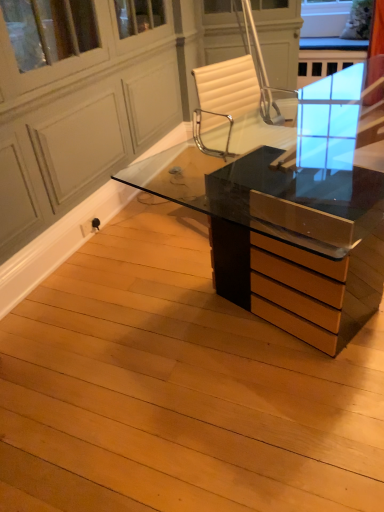
The image size is (384, 512). What do you see at coordinates (78, 102) in the screenshot? I see `transparent glass screen door at upper center` at bounding box center [78, 102].

What are the coordinates of `transparent glass screen door at upper center` in the screenshot? It's located at (78, 102).

Identify the location of matte black desk at center. (281, 238).

The height and width of the screenshot is (512, 384). What do you see at coordinates (281, 238) in the screenshot? I see `matte black desk at center` at bounding box center [281, 238].

Find the location of a particular element. transparent glass screen door at upper center is located at coordinates tap(78, 102).

Does matte black desk at center appear on the left side of transparent glass screen door at upper center?

Incorrect, matte black desk at center is not on the left side of transparent glass screen door at upper center.

Relative to transparent glass screen door at upper center, is matte black desk at center in front or behind?

matte black desk at center is positioned farther from the viewer than transparent glass screen door at upper center.

Does point (351, 333) come behind point (74, 149)?

That is False.

From the image's perspective, relative to transparent glass screen door at upper center, is matte black desk at center above or below?

Based on their image positions, matte black desk at center is located beneath transparent glass screen door at upper center.

From a real-world perspective, is matte black desk at center beneath transparent glass screen door at upper center?

Yes.

Considering the relative sizes of matte black desk at center and transparent glass screen door at upper center in the image provided, is matte black desk at center thinner than transparent glass screen door at upper center?

No.

Who is taller, matte black desk at center or transparent glass screen door at upper center?

With more height is transparent glass screen door at upper center.

In the scene shown: Does matte black desk at center have a larger size compared to transparent glass screen door at upper center?

No.

Do you think matte black desk at center is within transparent glass screen door at upper center, or outside of it?

matte black desk at center is located beyond the bounds of transparent glass screen door at upper center.

Is matte black desk at center not close to transparent glass screen door at upper center?

Yes, matte black desk at center is far from transparent glass screen door at upper center.

Could you tell me if matte black desk at center is facing transparent glass screen door at upper center?

Yes, matte black desk at center is turned towards transparent glass screen door at upper center.

Where is `desk directly beneath the transparent glass screen door at upper center (from a real-world perspective)`? This screenshot has height=512, width=384. desk directly beneath the transparent glass screen door at upper center (from a real-world perspective) is located at coordinates (281, 238).

Can you confirm if transparent glass screen door at upper center is positioned to the right of matte black desk at center?

Incorrect, transparent glass screen door at upper center is not on the right side of matte black desk at center.

Considering the relative positions of transparent glass screen door at upper center and matte black desk at center in the image provided, is transparent glass screen door at upper center in front of matte black desk at center?

Yes.

Considering the positions of points (51, 33) and (225, 197), is point (51, 33) farther from camera compared to point (225, 197)?

Yes, it is.

From the image's perspective, which one is positioned lower, transparent glass screen door at upper center or matte black desk at center?

matte black desk at center is shown below in the image.

From a real-world perspective, which is physically below, transparent glass screen door at upper center or matte black desk at center?

In real-world perspective, matte black desk at center is lower.

Which of these two, transparent glass screen door at upper center or matte black desk at center, is thinner?

With smaller width is transparent glass screen door at upper center.

In the scene shown: Is transparent glass screen door at upper center shorter than matte black desk at center?

In fact, transparent glass screen door at upper center may be taller than matte black desk at center.

In the scene shown: Does transparent glass screen door at upper center have a smaller size compared to matte black desk at center?

No, transparent glass screen door at upper center is not smaller than matte black desk at center.

Is transparent glass screen door at upper center located outside matte black desk at center?

Indeed, transparent glass screen door at upper center is completely outside matte black desk at center.

Is transparent glass screen door at upper center touching matte black desk at center?

No, transparent glass screen door at upper center is not in contact with matte black desk at center.

Based on the photo, does transparent glass screen door at upper center turn towards matte black desk at center?

Yes, transparent glass screen door at upper center is facing matte black desk at center.

Can you tell me how much transparent glass screen door at upper center and matte black desk at center differ in facing direction?

The facing directions of transparent glass screen door at upper center and matte black desk at center are 159 degrees apart.

Where is `screen door that is above the matte black desk at center (from the image's perspective)`? The height and width of the screenshot is (512, 384). screen door that is above the matte black desk at center (from the image's perspective) is located at coordinates (78, 102).

Locate an element on the screen. The image size is (384, 512). desk that is behind the transparent glass screen door at upper center is located at coordinates (281, 238).

Identify the location of desk located below the transparent glass screen door at upper center (from the image's perspective). (281, 238).